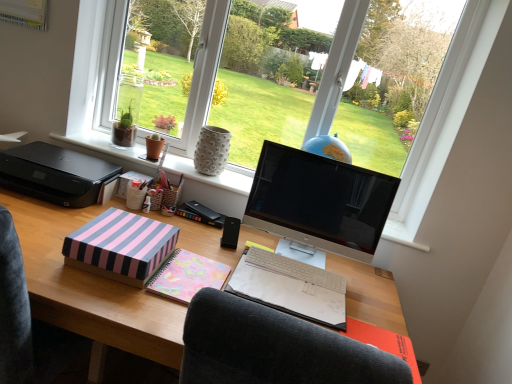
The image size is (512, 384). Identify the location of free area behind pastel butterfly-patterned paper at center. pos(210,248).